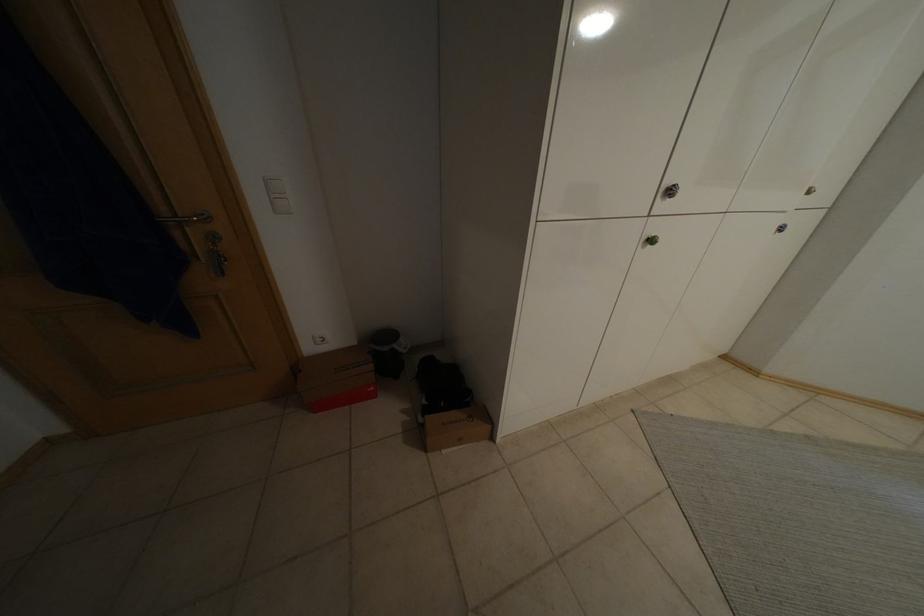
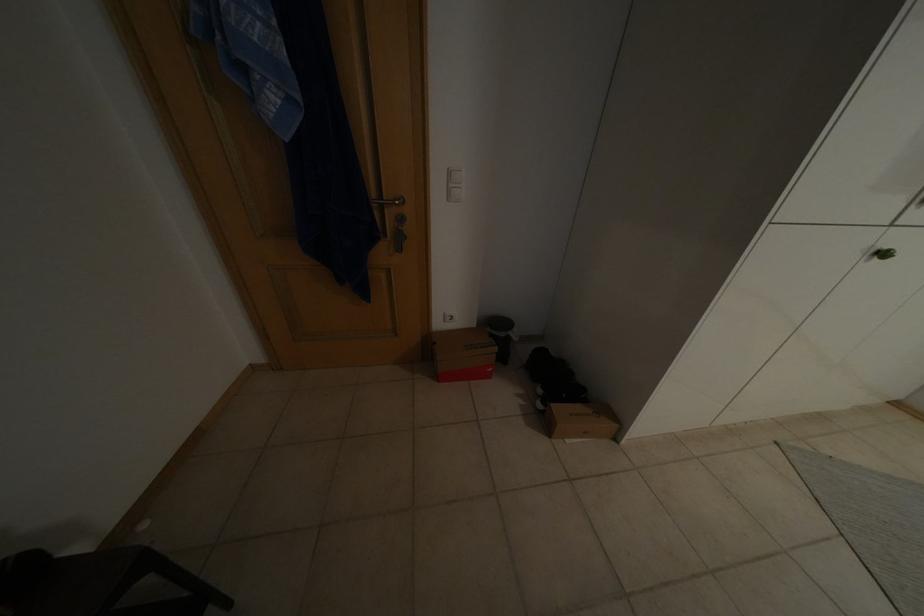
Question: The camera is either moving clockwise (left) or counter-clockwise (right) around the object. The first image is from the beginning of the video and the second image is from the end. Is the camera moving left or right when shooting the video?

Choices:
 (A) Left
 (B) Right

Answer: (B)